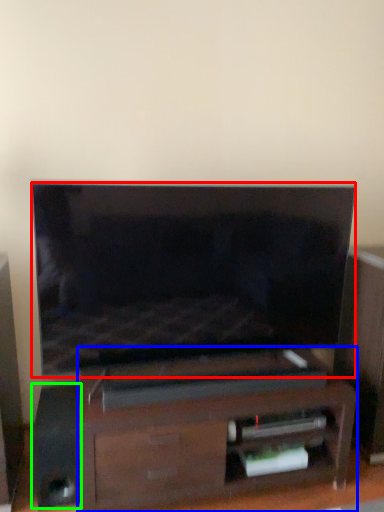
Question: Which object is the farthest from television (highlighted by a red box)? Choose among these: furniture (highlighted by a blue box) or speaker (highlighted by a green box).

Choices:
 (A) furniture
 (B) speaker

Answer: (B)